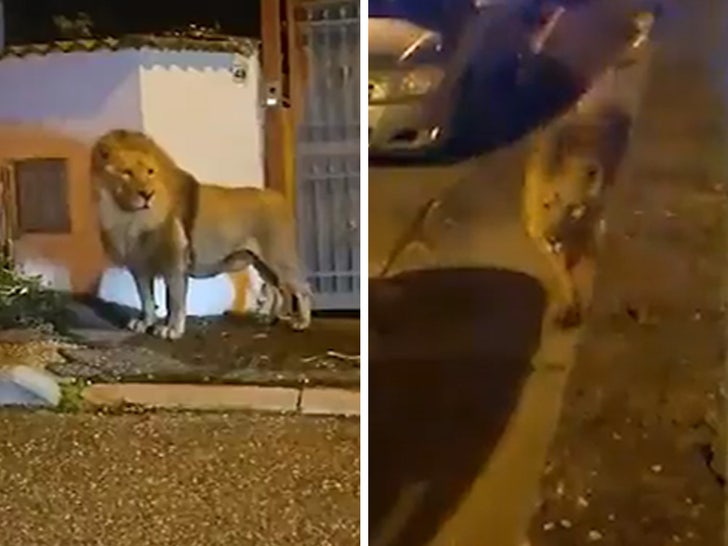
This screenshot has width=728, height=546. Find the location of `wall`. wall is located at coordinates (188, 118).